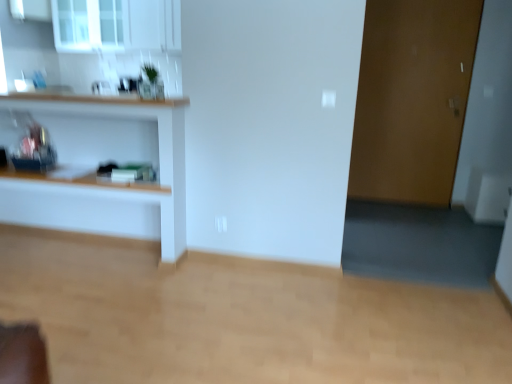
Question: Looking at the image, does transparent glass window at upper left seem bigger or smaller compared to wooden shelf at left?

Choices:
 (A) big
 (B) small

Answer: (B)

Question: From a real-world perspective, is transparent glass window at upper left above or below wooden shelf at left?

Choices:
 (A) above
 (B) below

Answer: (A)

Question: Which object is positioned farthest from the brown matte door at right?

Choices:
 (A) wooden shelf at left
 (B) transparent glass window at upper left

Answer: (B)

Question: Considering the real-world distances, which object is closest to the transparent glass window at upper left?

Choices:
 (A) brown matte door at right
 (B) wooden shelf at left

Answer: (B)